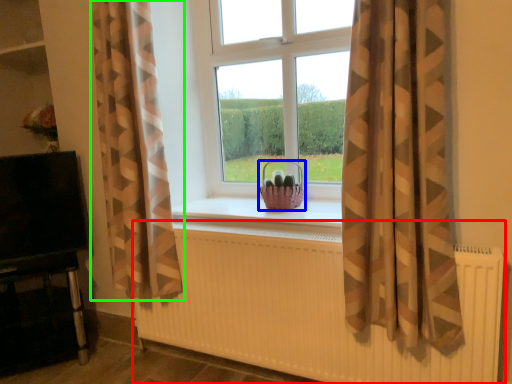
Question: Considering the real-world distances, which object is farthest from radiator (highlighted by a red box)? basket (highlighted by a blue box) or curtain (highlighted by a green box)?

Choices:
 (A) basket
 (B) curtain

Answer: (A)